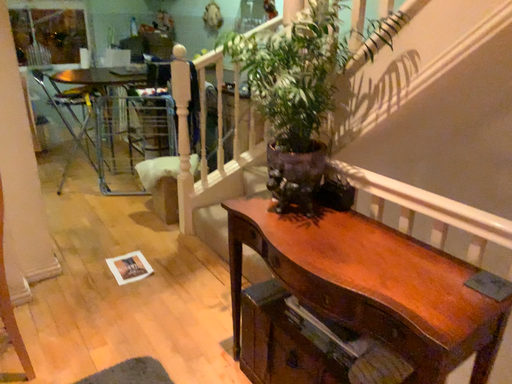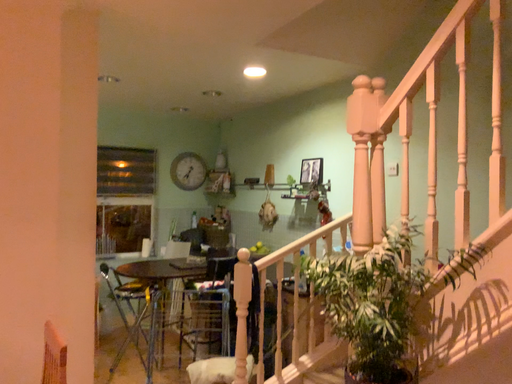
Question: How did the camera likely rotate when shooting the video?

Choices:
 (A) rotated upward
 (B) rotated downward

Answer: (A)